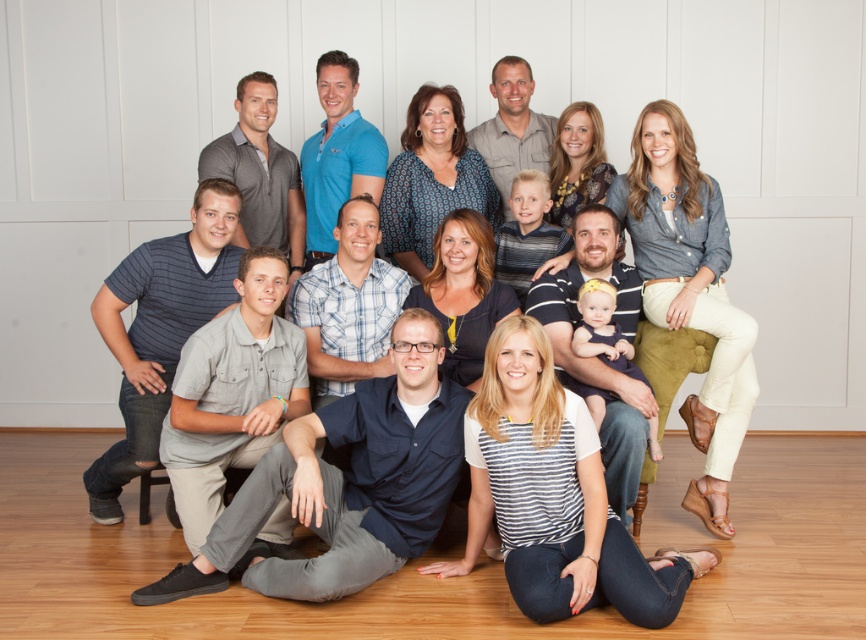
You are a photographer adjusting the lighting for a family portrait. You notice two shirts in the center of the image labeled dark blue shirt at center and matte blue shirt at center. Given that your camera has a minimum focus distance of 80 centimeters, will both shirts be in focus simultaneously?

The dark blue shirt at center and matte blue shirt at center are 82.19 centimeters apart. Since the distance between them is greater than the camera minimum focus distance of 80 centimeters, both shirts will be in focus simultaneously.

You are organizing a clothing display and need to arrange the dark blue shirt at center and the matte blue shirt at center based on their sizes. Which shirt should you place on the lower shelf if you want the smaller one to be more visible to customers?

The dark blue shirt at center has a smaller size compared to the matte blue shirt at center, so you should place the dark blue shirt at center on the lower shelf to make it more visible.